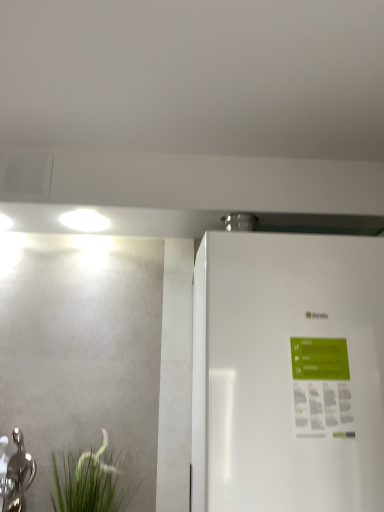
This screenshot has height=512, width=384. What do you see at coordinates (16, 476) in the screenshot?
I see `silver metallic tap at lower left` at bounding box center [16, 476].

This screenshot has height=512, width=384. What are the coordinates of `green matte plant at lower left` in the screenshot? It's located at tap(90, 482).

Find the location of `white glossy refrigerator at right`. white glossy refrigerator at right is located at coordinates (288, 373).

Considering the relative sizes of green matte plant at lower left and silver metallic tap at lower left in the image provided, is green matte plant at lower left thinner than silver metallic tap at lower left?

No, green matte plant at lower left is not thinner than silver metallic tap at lower left.

How far apart are green matte plant at lower left and silver metallic tap at lower left?

green matte plant at lower left is 6.94 inches away from silver metallic tap at lower left.

Which is more to the right, green matte plant at lower left or silver metallic tap at lower left?

green matte plant at lower left is more to the right.

From the image's perspective, who appears lower, green matte plant at lower left or silver metallic tap at lower left?

green matte plant at lower left.

Considering the positions of objects white glossy refrigerator at right and silver metallic tap at lower left in the image provided, who is more to the left, white glossy refrigerator at right or silver metallic tap at lower left?

silver metallic tap at lower left.

In order to click on tap lying behind the white glossy refrigerator at right in this screenshot , I will do `click(16, 476)`.

Between white glossy refrigerator at right and silver metallic tap at lower left, which one has less height?

Standing shorter between the two is silver metallic tap at lower left.

Which is correct: white glossy refrigerator at right is inside silver metallic tap at lower left, or outside of it?

white glossy refrigerator at right is not enclosed by silver metallic tap at lower left.

How much distance is there between white glossy refrigerator at right and green matte plant at lower left?

A distance of 26.52 inches exists between white glossy refrigerator at right and green matte plant at lower left.

Which of these two, white glossy refrigerator at right or green matte plant at lower left, stands taller?

white glossy refrigerator at right is taller.

Is white glossy refrigerator at right facing towards green matte plant at lower left?

No, white glossy refrigerator at right does not turn towards green matte plant at lower left.

From the picture: Is white glossy refrigerator at right to the left or to the right of green matte plant at lower left in the image?

Based on their positions, white glossy refrigerator at right is located to the right of green matte plant at lower left.

Is the position of green matte plant at lower left more distant than that of white glossy refrigerator at right?

Yes, green matte plant at lower left is behind white glossy refrigerator at right.

From the image's perspective, relative to white glossy refrigerator at right, is green matte plant at lower left above or below?

Based on their image positions, green matte plant at lower left is located beneath white glossy refrigerator at right.

From a real-world perspective, is green matte plant at lower left physically located above or below white glossy refrigerator at right?

green matte plant at lower left is below white glossy refrigerator at right.

Is silver metallic tap at lower left oriented away from green matte plant at lower left?

silver metallic tap at lower left is not turned away from green matte plant at lower left.

You are a GUI agent. You are given a task and a screenshot of the screen. Output one action in this format:
    pyautogui.click(x=<x>, y=<y>)
    Task: Click on the plant directly beneath the silver metallic tap at lower left (from a real-world perspective)
    This screenshot has width=384, height=512.
    Given the screenshot: What is the action you would take?
    pyautogui.click(x=90, y=482)

Which is behind, point (13, 478) or point (109, 473)?

Point (13, 478)

Is silver metallic tap at lower left not inside green matte plant at lower left?

silver metallic tap at lower left is positioned outside green matte plant at lower left.

Locate an element on the screen. The width and height of the screenshot is (384, 512). refrigerator that is above the silver metallic tap at lower left (from the image's perspective) is located at coordinates (288, 373).

Consider the image. Would you say silver metallic tap at lower left is inside or outside white glossy refrigerator at right?

silver metallic tap at lower left is located beyond the bounds of white glossy refrigerator at right.

Based on the photo, how distant is silver metallic tap at lower left from white glossy refrigerator at right?

silver metallic tap at lower left and white glossy refrigerator at right are 36.09 inches apart.

Does point (7, 442) appear closer or farther from the camera than point (239, 463)?

Point (7, 442) appears to be farther away from the viewer than point (239, 463).

I want to click on plant that is on the right side of silver metallic tap at lower left, so click(x=90, y=482).

In the image, there is a silver metallic tap at lower left. At what (x,y) coordinates should I click in order to perform the action: click on refrigerator above it (from the image's perspective). Please return your answer as a coordinate pair (x, y). Looking at the image, I should click on (288, 373).

Considering their positions, is silver metallic tap at lower left positioned further to white glossy refrigerator at right than green matte plant at lower left?

silver metallic tap at lower left is further to white glossy refrigerator at right.

Considering their positions, is white glossy refrigerator at right positioned further to green matte plant at lower left than silver metallic tap at lower left?

white glossy refrigerator at right is further to green matte plant at lower left.

From the image, which object appears to be farther from white glossy refrigerator at right, green matte plant at lower left or silver metallic tap at lower left?

silver metallic tap at lower left lies further to white glossy refrigerator at right than the other object.

From the image, which object appears to be nearer to green matte plant at lower left, silver metallic tap at lower left or white glossy refrigerator at right?

silver metallic tap at lower left lies closer to green matte plant at lower left than the other object.

Based on their spatial positions, is green matte plant at lower left or white glossy refrigerator at right closer to silver metallic tap at lower left?

Among the two, green matte plant at lower left is located nearer to silver metallic tap at lower left.

When comparing their distances from silver metallic tap at lower left, does white glossy refrigerator at right or green matte plant at lower left seem closer?

green matte plant at lower left is positioned closer to the anchor silver metallic tap at lower left.

The image size is (384, 512). Find the location of `plant between silver metallic tap at lower left and white glossy refrigerator at right`. plant between silver metallic tap at lower left and white glossy refrigerator at right is located at coordinates (90, 482).